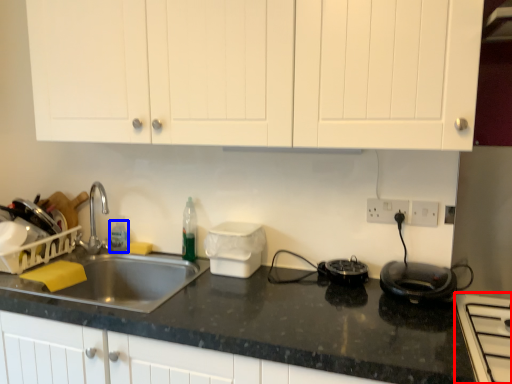
Question: Which of the following is the closest to the observer, home appliance (highlighted by a red box) or bottle (highlighted by a blue box)?

Choices:
 (A) home appliance
 (B) bottle

Answer: (A)